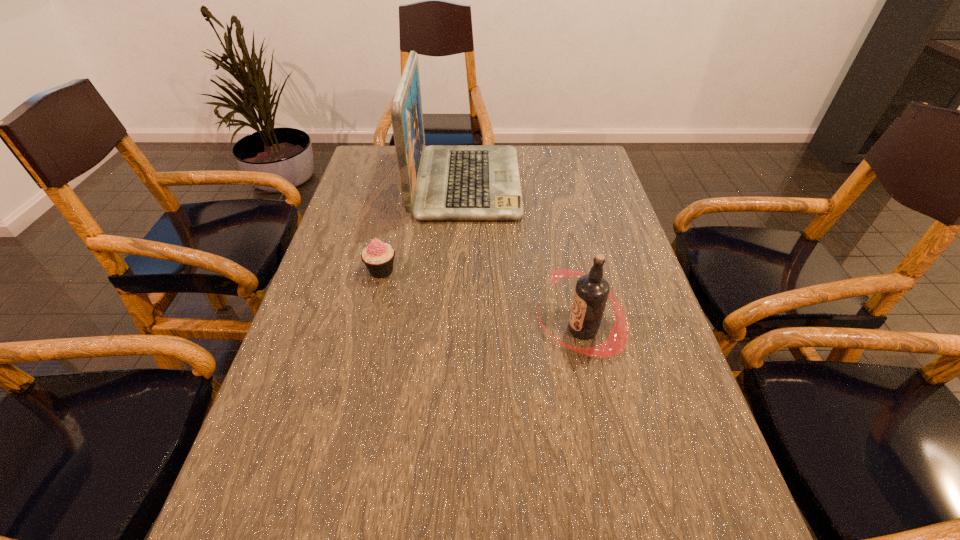
This screenshot has height=540, width=960. What are the coordinates of `vacant space located on the back of the cupcake` in the screenshot? It's located at (393, 221).

Find the location of a particular element. The height and width of the screenshot is (540, 960). object located in the far edge section of the desktop is located at coordinates pos(440,182).

Where is `object that is at the left edge`? Image resolution: width=960 pixels, height=540 pixels. object that is at the left edge is located at coordinates coord(378,257).

The image size is (960, 540). Find the location of `object positioned at the right edge`. object positioned at the right edge is located at coordinates (591, 293).

Where is `vacant space at the left edge`? The image size is (960, 540). vacant space at the left edge is located at coordinates (398, 186).

The image size is (960, 540). Identify the location of vacant region at the right edge. click(584, 190).

Identify the location of vacant space at the far left corner of the desktop. (394, 172).

In the image, there is a desktop. At what (x,y) coordinates should I click in order to perform the action: click on free region at the far right corner. Please return your answer as a coordinate pair (x, y). This screenshot has width=960, height=540. Looking at the image, I should click on point(603,180).

This screenshot has width=960, height=540. I want to click on free space between the tallest object and the root beer, so click(524, 256).

Where is `free space that is in between the cupcake and the tallest object`? free space that is in between the cupcake and the tallest object is located at coordinates (423, 227).